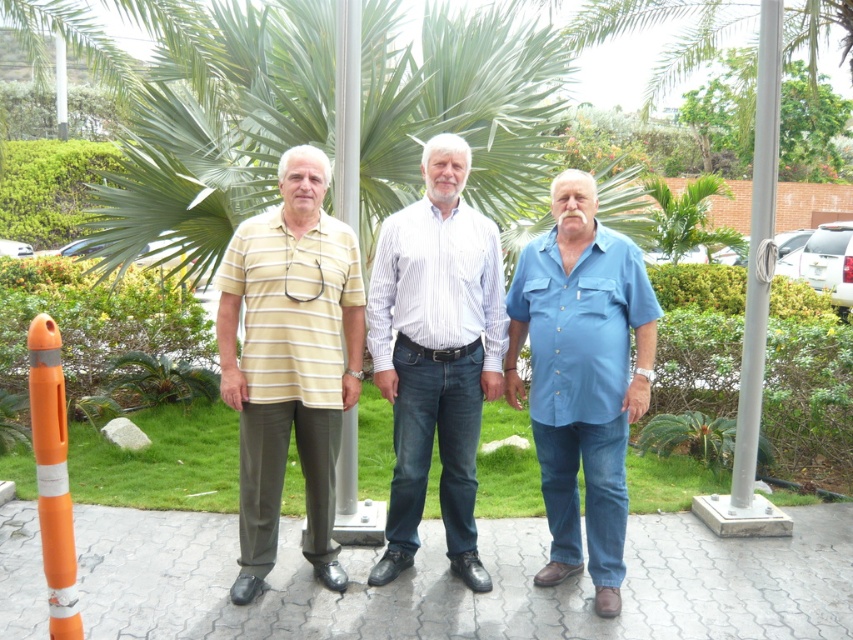
You are a photographer setting up for a group photo. You notice a white metallic pole at upper right and an orange matte traffic cone at left in the background. Which object is wider?

The white metallic pole at upper right is wider than the orange matte traffic cone at left.

You are a photographer trying to adjust the focus of your camera to ensure both the striped cotton polo shirt at center and the blue cotton shirt at center are clearly visible. Given their sizes, which shirt should you focus on first to ensure proper focus depth?

The striped cotton polo shirt at center is smaller than the blue cotton shirt at center, so you should focus on the striped cotton polo shirt at center first to ensure the depth of field captures both shirts clearly.